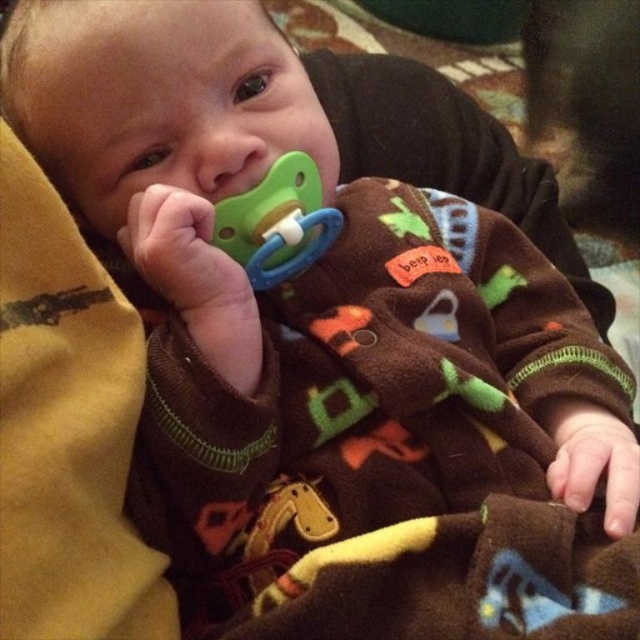
You are a caregiver and need to cover the baby with the brown fleece blanket at lower center while ensuring the green rubber pacifier at center stays in place. Is the blanket large enough to cover the baby without disturbing the pacifier?

The brown fleece blanket at lower center has a larger size compared to green rubber pacifier at center, so it is large enough to cover the baby while keeping the pacifier in place.

You are a photographer setting up for a baby photo shoot. The baby is lying on a brown fleece blanket at lower center. You want to place a toy car exactly at point (458, 580). Is this point on the brown fleece blanket at lower center?

Yes, the point (458, 580) is on the brown fleece blanket at lower center as indicated by the coordinates provided.

You are a caregiver trying to comfort a baby. The baby is lying on a brown fleece blanket at lower center and has a green rubber pacifier at center in their mouth. Which item is closer to the right side of the pacifier?

The brown fleece blanket at lower center is positioned on the right side of the green rubber pacifier at center, so the brown fleece blanket at lower center is closer to the right side of the pacifier.